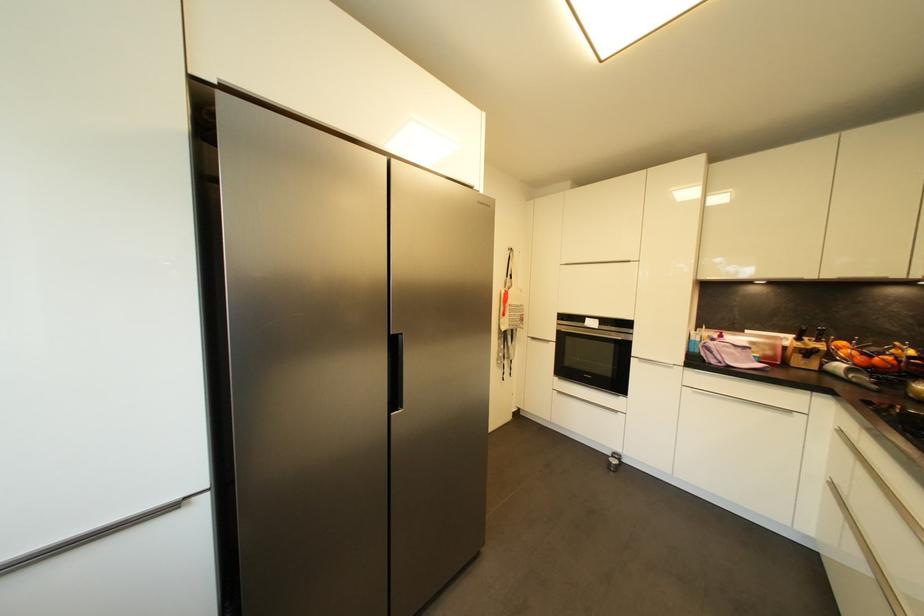
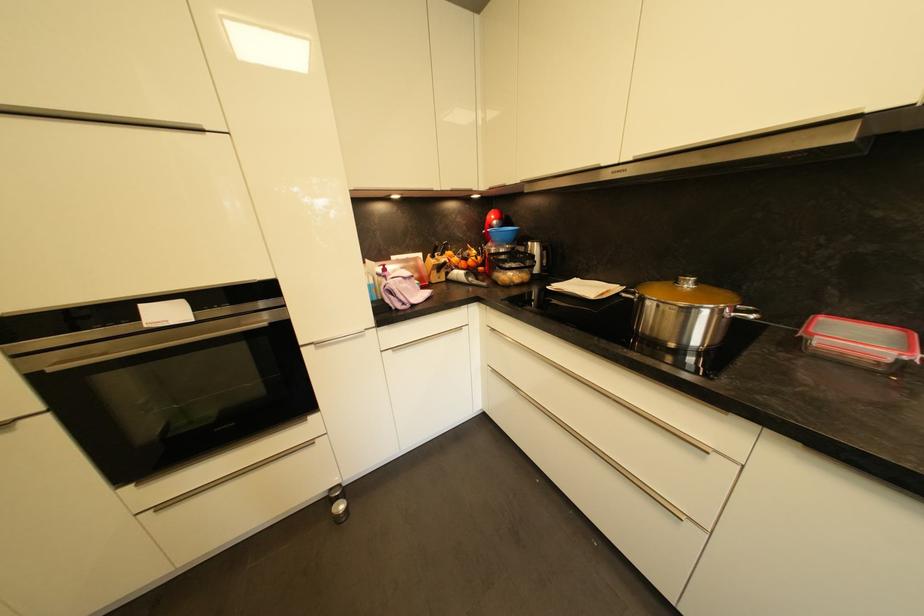
Where in the second image is the point corresponding to the point at 867,361 from the first image?

(468, 265)